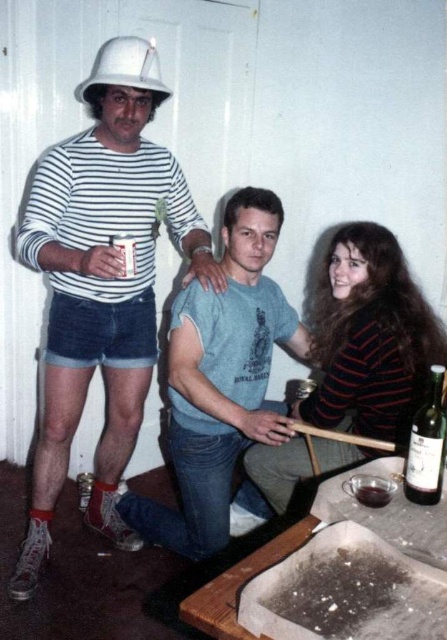
Question: Is green glass bottle at lower right below white matte hard hat at upper left?

Choices:
 (A) no
 (B) yes

Answer: (B)

Question: Does matte blue t-shirt at center appear under green glass bottle at lower right?

Choices:
 (A) yes
 (B) no

Answer: (A)

Question: Can you confirm if striped knit sweater at center is thinner than white matte hard hat at upper left?

Choices:
 (A) no
 (B) yes

Answer: (A)

Question: Which object appears closest to the camera in this image?

Choices:
 (A) dark glass wine at lower center
 (B) striped knit sweater at center

Answer: (A)

Question: Which point is closer to the camera taking this photo?

Choices:
 (A) (244, 262)
 (B) (125, 38)
 (C) (387, 387)
 (D) (421, 481)

Answer: (D)

Question: Which of the following is the farthest from the observer?

Choices:
 (A) (438, 333)
 (B) (416, 433)

Answer: (A)